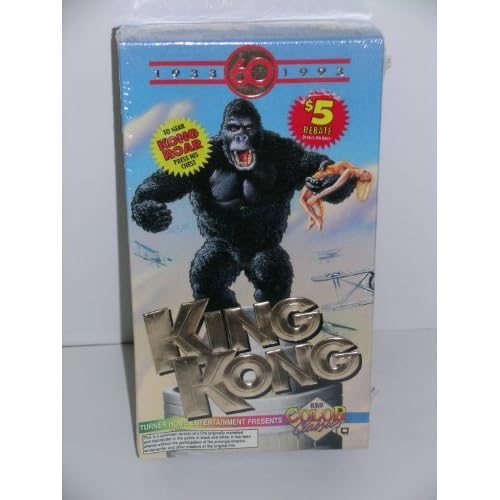
Find the location of a particular element. The width and height of the screenshot is (500, 500). stand is located at coordinates (276, 400).